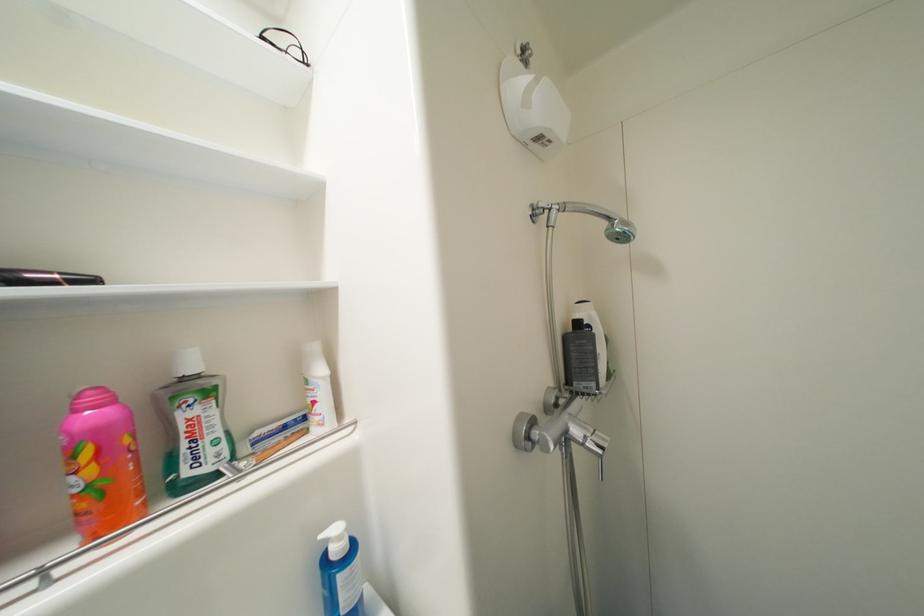
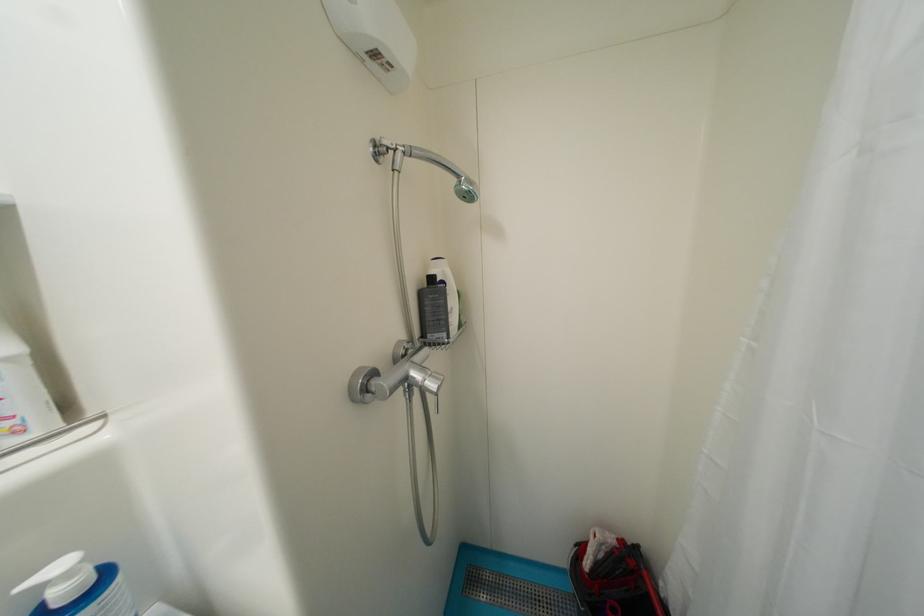
In the second image, find the point that corresponds to (x=585, y=326) in the first image.

(439, 281)